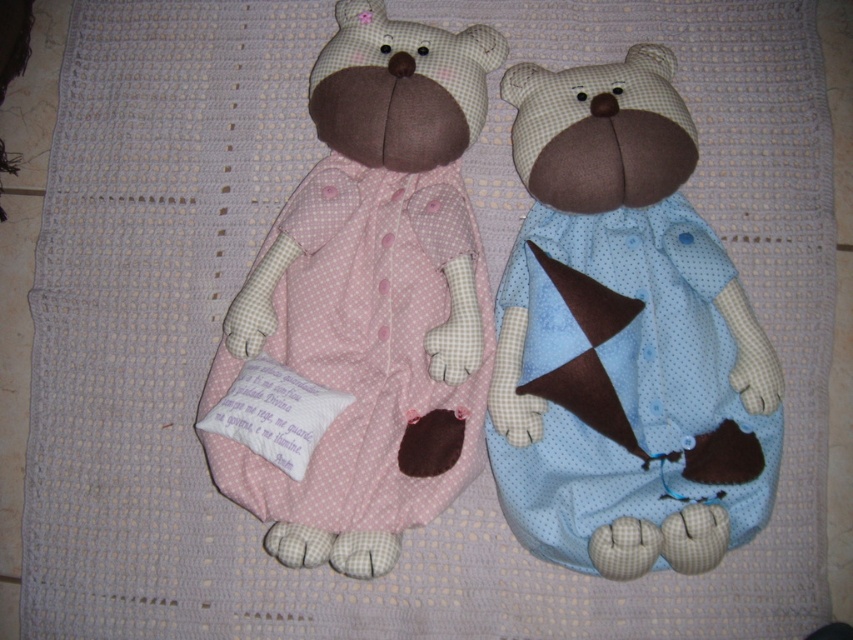
Who is more forward, (520, 429) or (363, 228)?

Point (520, 429)

Between matte blue fabric teddy bear at right and pink polka dot fabric teddy bear at center, which one has less height?

With less height is matte blue fabric teddy bear at right.

What do you see at coordinates (624, 337) in the screenshot? The height and width of the screenshot is (640, 853). I see `matte blue fabric teddy bear at right` at bounding box center [624, 337].

Image resolution: width=853 pixels, height=640 pixels. I want to click on matte blue fabric teddy bear at right, so click(x=624, y=337).